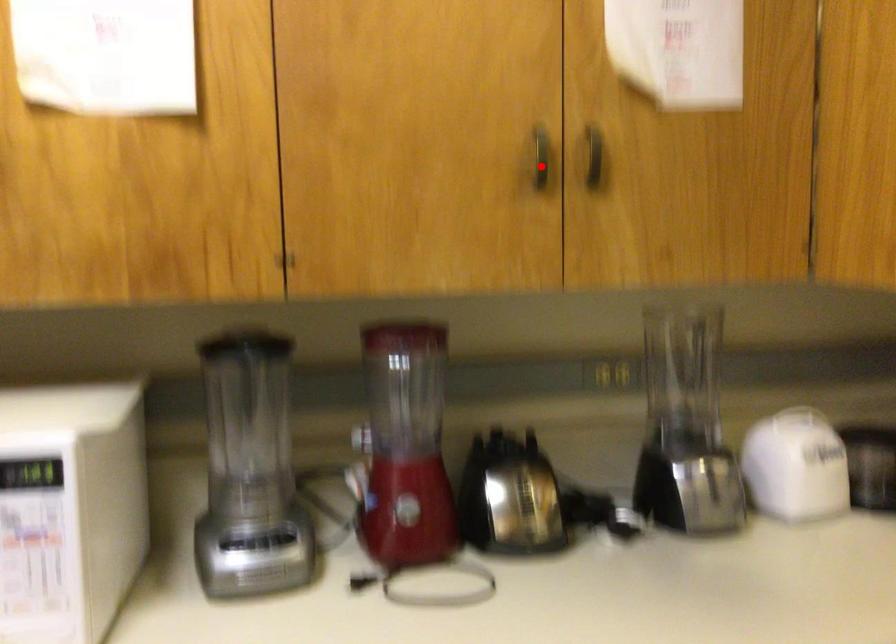
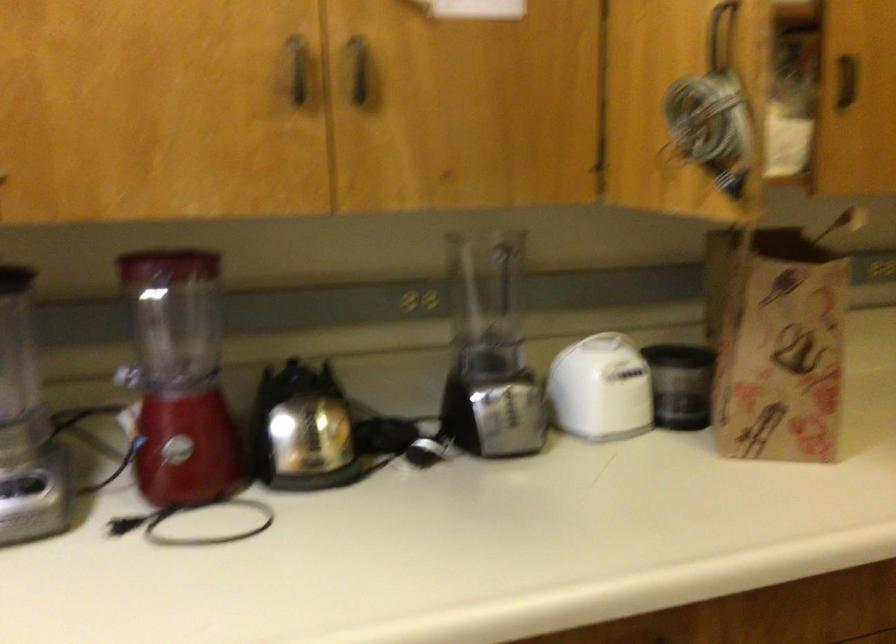
Where in the second image is the point corresponding to the highlighted location from the first image?

(297, 69)